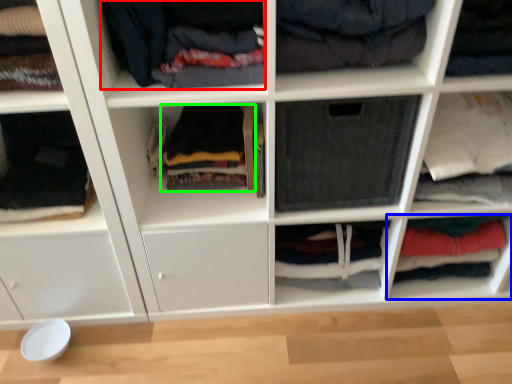
Question: Which object is positioned closest to clothing (highlighted by a red box)? Select from cabinet (highlighted by a blue box) and clothing (highlighted by a green box).

Choices:
 (A) cabinet
 (B) clothing

Answer: (B)